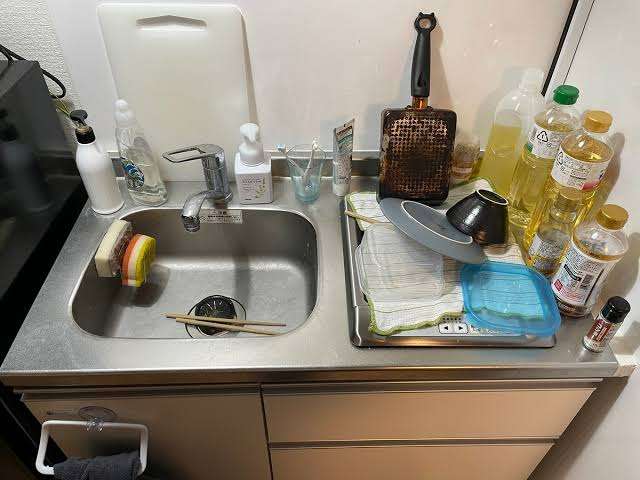
At what (x,y) coordinates should I click in order to perform the action: click on sink door. Please return your answer as a coordinate pair (x, y). Looking at the image, I should click on point(196,460).